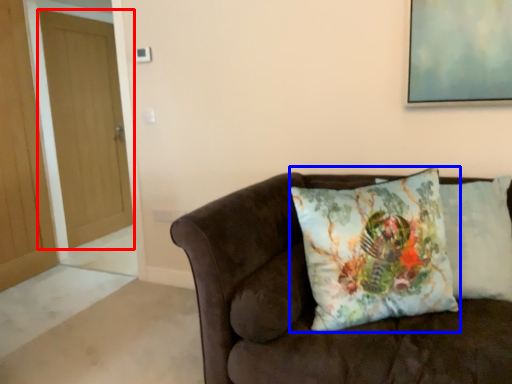
Question: Among these objects, which one is farthest to the camera, door (highlighted by a red box) or pillow (highlighted by a blue box)?

Choices:
 (A) door
 (B) pillow

Answer: (A)